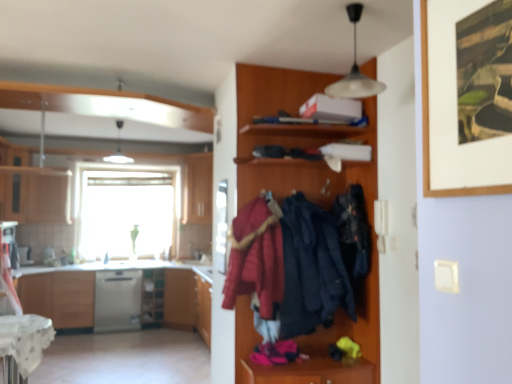
Locate an element on the screen. vacant area on top of wooden coat rack at center (from a real-world perspective) is located at coordinates (304, 62).